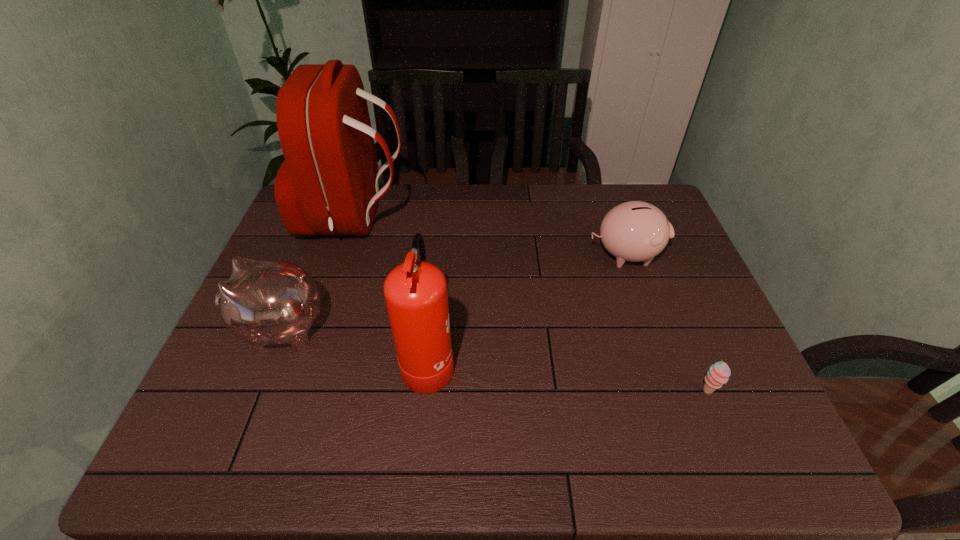
Locate an element on the screen. This screenshot has width=960, height=540. backpack is located at coordinates (328, 185).

Where is `the third object from left to right`? This screenshot has width=960, height=540. the third object from left to right is located at coordinates tap(415, 292).

Identify the location of fire extinguisher. (415, 292).

You are a GUI agent. You are given a task and a screenshot of the screen. Output one action in this format:
    pyautogui.click(x=<x>, y=<y>)
    Task: Click on the nearer piggy bank
    
    Given the screenshot: What is the action you would take?
    pyautogui.click(x=264, y=302)

Find the location of `the left piggy bank`. the left piggy bank is located at coordinates (264, 302).

This screenshot has width=960, height=540. In order to click on the right piggy bank in this screenshot , I will do click(634, 231).

At what (x,y) coordinates should I click in order to perform the action: click on the shorter piggy bank. Please return your answer as a coordinate pair (x, y). The image size is (960, 540). Looking at the image, I should click on click(x=634, y=231).

Locate an element on the screen. Image resolution: width=960 pixels, height=540 pixels. the shortest object is located at coordinates (718, 374).

This screenshot has height=540, width=960. I want to click on vacant space situated 0.250m on the strap side of the tallest object, so click(x=484, y=219).

Locate an element on the screen. This screenshot has height=540, width=960. vacant space situated 0.110m towards the nozzle of the fire extinguisher is located at coordinates (501, 359).